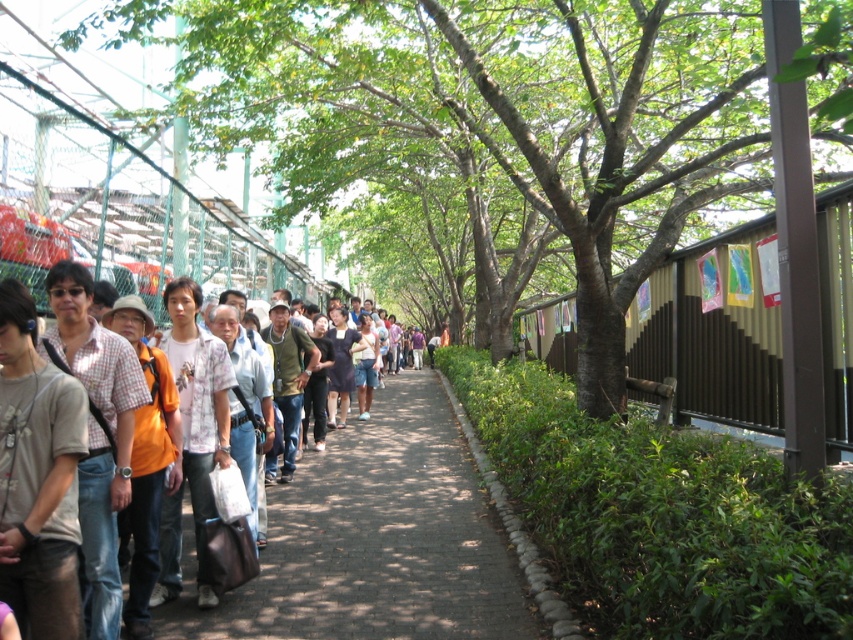
Question: Can you confirm if green leafy tree at center is positioned to the left of matte black shirt at center?

Choices:
 (A) no
 (B) yes

Answer: (B)

Question: Which of the following is the farthest from the observer?

Choices:
 (A) brick paved sidewalk at center
 (B) green leafy tree at center
 (C) matte black shirt at center

Answer: (A)

Question: Which point appears farthest from the camera in this image?

Choices:
 (A) (431, 557)
 (B) (357, 493)
 (C) (59, 529)
 (D) (134, 10)

Answer: (B)

Question: Is green leafy tree at center thinner than matte brown shirt at left?

Choices:
 (A) yes
 (B) no

Answer: (B)

Question: Which point is farther from the camera taking this photo?

Choices:
 (A) (753, 164)
 (B) (15, 513)
 (C) (219, 616)

Answer: (A)

Question: Is green leafy tree at center to the right of brick paved sidewalk at center from the viewer's perspective?

Choices:
 (A) no
 (B) yes

Answer: (A)